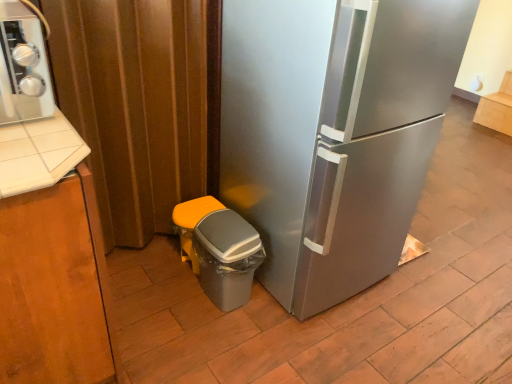
This screenshot has width=512, height=384. Describe the element at coordinates (497, 108) in the screenshot. I see `matte wood cabinet at upper right, placed as the first cabinetry when sorted from top to bottom` at that location.

This screenshot has height=384, width=512. Describe the element at coordinates (54, 288) in the screenshot. I see `brushed wood cabinet at left, positioned as the 2th cabinetry in top-to-bottom order` at that location.

Describe the element at coordinates (192, 224) in the screenshot. I see `gray plastic trash can at lower left` at that location.

Image resolution: width=512 pixels, height=384 pixels. Describe the element at coordinates (335, 131) in the screenshot. I see `stainless steel refrigerator at center` at that location.

The width and height of the screenshot is (512, 384). What do you see at coordinates (23, 66) in the screenshot?
I see `brushed metal stove at upper left` at bounding box center [23, 66].

The height and width of the screenshot is (384, 512). Identify the location of matte wood cabinet at upper right, placed as the first cabinetry when sorted from top to bottom. (497, 108).

Is gray plastic trash can at lower left looking in the opposite direction of matte brown curtain at left?

Yes, gray plastic trash can at lower left is facing away from matte brown curtain at left.

Is the surface of gray plastic trash can at lower left in direct contact with matte brown curtain at left?

No, gray plastic trash can at lower left is not in contact with matte brown curtain at left.

In the scene shown: Between gray plastic trash can at lower left and matte brown curtain at left, which one has smaller size?

gray plastic trash can at lower left.

From a real-world perspective, is brushed metal stove at upper left positioned over brushed wood cabinet at left, positioned as the 2th cabinetry in top-to-bottom order, based on gravity?

Yes, from a real-world perspective, brushed metal stove at upper left is on top of brushed wood cabinet at left, positioned as the 2th cabinetry in top-to-bottom order.

Where is `appliance lying above the brushed wood cabinet at left, placed as the first cabinetry when sorted from left to right (from the image's perspective)`? The width and height of the screenshot is (512, 384). appliance lying above the brushed wood cabinet at left, placed as the first cabinetry when sorted from left to right (from the image's perspective) is located at coordinates (23, 66).

Does brushed metal stove at upper left have a smaller size compared to brushed wood cabinet at left, the 2th cabinetry positioned from the back?

Yes.

Does brushed metal stove at upper left lie in front of brushed wood cabinet at left, the 2th cabinetry positioned from the back?

No, brushed metal stove at upper left is further to the viewer.

Considering the relative positions of gray plastic trash can at lower left and stainless steel refrigerator at center in the image provided, is gray plastic trash can at lower left behind stainless steel refrigerator at center?

Yes.

You are a GUI agent. You are given a task and a screenshot of the screen. Output one action in this format:
    pyautogui.click(x=<x>, y=<y>)
    Task: Click on the refrigerator located in front of the gray plastic trash can at lower left
    Image resolution: width=512 pixels, height=384 pixels.
    Given the screenshot: What is the action you would take?
    pyautogui.click(x=335, y=131)

Can you confirm if gray plastic trash can at lower left is wider than stainless steel refrigerator at center?

No, gray plastic trash can at lower left is not wider than stainless steel refrigerator at center.

Based on their positions, is gray plastic trash can at lower left located to the left or right of stainless steel refrigerator at center?

gray plastic trash can at lower left is positioned on stainless steel refrigerator at center's left side.

Are matte wood cabinet at upper right, placed as the 1th cabinetry when sorted from back to front, and matte brown curtain at left making contact?

No, matte wood cabinet at upper right, placed as the 1th cabinetry when sorted from back to front, is not next to matte brown curtain at left.

From the image's perspective, which one is positioned lower, matte wood cabinet at upper right, placed as the first cabinetry when sorted from top to bottom, or matte brown curtain at left?

matte brown curtain at left.

Is matte wood cabinet at upper right, the second cabinetry from the front, aimed at matte brown curtain at left?

Yes, matte wood cabinet at upper right, the second cabinetry from the front, is facing matte brown curtain at left.

Could you tell me if matte brown curtain at left is turned towards brushed wood cabinet at left, placed as the first cabinetry when sorted from left to right?

No, matte brown curtain at left is not facing towards brushed wood cabinet at left, placed as the first cabinetry when sorted from left to right.

Looking at this image, are matte brown curtain at left and brushed wood cabinet at left, placed as the first cabinetry when sorted from bottom to top, far apart?

No.

Which of these two, matte brown curtain at left or brushed wood cabinet at left, placed as the 2th cabinetry when sorted from right to left, stands shorter?

brushed wood cabinet at left, placed as the 2th cabinetry when sorted from right to left, is shorter.

From the image's perspective, is matte brown curtain at left located above brushed wood cabinet at left, placed as the 2th cabinetry when sorted from right to left?

Correct, matte brown curtain at left appears higher than brushed wood cabinet at left, placed as the 2th cabinetry when sorted from right to left, in the image.

Considering the relative positions of matte brown curtain at left and gray plastic trash can at lower left in the image provided, is matte brown curtain at left to the left of gray plastic trash can at lower left from the viewer's perspective?

Yes, matte brown curtain at left is to the left of gray plastic trash can at lower left.

Is there a large distance between matte brown curtain at left and gray plastic trash can at lower left?

No, there isn't a large distance between matte brown curtain at left and gray plastic trash can at lower left.

Considering the sizes of objects matte brown curtain at left and gray plastic trash can at lower left in the image provided, who is bigger, matte brown curtain at left or gray plastic trash can at lower left?

matte brown curtain at left is bigger.

Which object is wider, matte brown curtain at left or gray plastic trash can at lower left?

gray plastic trash can at lower left is wider.

Is brushed metal stove at upper left turned away from matte wood cabinet at upper right, placed as the first cabinetry when sorted from top to bottom?

No, brushed metal stove at upper left is not facing the opposite direction of matte wood cabinet at upper right, placed as the first cabinetry when sorted from top to bottom.

Who is taller, brushed metal stove at upper left or matte wood cabinet at upper right, placed as the 1th cabinetry when sorted from back to front?

Standing taller between the two is brushed metal stove at upper left.

Is brushed metal stove at upper left with matte wood cabinet at upper right, placed as the first cabinetry when sorted from top to bottom?

No, brushed metal stove at upper left is not touching matte wood cabinet at upper right, placed as the first cabinetry when sorted from top to bottom.

Locate an element on the screen. The width and height of the screenshot is (512, 384). curtain above the gray plastic trash can at lower left (from the image's perspective) is located at coordinates (135, 105).

Find the location of a particular element. cabinetry that appears in front of the brushed metal stove at upper left is located at coordinates (54, 288).

Based on their spatial positions, is brushed wood cabinet at left, placed as the first cabinetry when sorted from bottom to top, or matte brown curtain at left further from gray plastic potty at lower left?

Among the two, brushed wood cabinet at left, placed as the first cabinetry when sorted from bottom to top, is located further to gray plastic potty at lower left.

Which object lies further to the anchor point gray plastic potty at lower left, stainless steel refrigerator at center or brushed metal stove at upper left?

The object further to gray plastic potty at lower left is brushed metal stove at upper left.

Which object lies further to the anchor point matte wood cabinet at upper right, placed as the 2th cabinetry when sorted from bottom to top, brushed wood cabinet at left, placed as the 2th cabinetry when sorted from right to left, or gray plastic trash can at lower left?

The object further to matte wood cabinet at upper right, placed as the 2th cabinetry when sorted from bottom to top, is brushed wood cabinet at left, placed as the 2th cabinetry when sorted from right to left.

Based on their spatial positions, is gray plastic potty at lower left or matte wood cabinet at upper right, the 1th cabinetry positioned from the right, further from brushed wood cabinet at left, the 2th cabinetry positioned from the back?

matte wood cabinet at upper right, the 1th cabinetry positioned from the right, is positioned further to the anchor brushed wood cabinet at left, the 2th cabinetry positioned from the back.

Looking at the image, which one is located closer to gray plastic potty at lower left, gray plastic trash can at lower left or brushed wood cabinet at left, positioned as the 2th cabinetry in top-to-bottom order?

gray plastic trash can at lower left is closer to gray plastic potty at lower left.

From the image, which object appears to be farther from gray plastic potty at lower left, gray plastic trash can at lower left or brushed metal stove at upper left?

brushed metal stove at upper left lies further to gray plastic potty at lower left than the other object.

Which object lies further to the anchor point matte brown curtain at left, stainless steel refrigerator at center or matte wood cabinet at upper right, the second cabinetry from the front?

Among the two, matte wood cabinet at upper right, the second cabinetry from the front, is located further to matte brown curtain at left.

Looking at the image, which one is located closer to brushed wood cabinet at left, placed as the first cabinetry when sorted from left to right, stainless steel refrigerator at center or brushed metal stove at upper left?

Based on the image, brushed metal stove at upper left appears to be nearer to brushed wood cabinet at left, placed as the first cabinetry when sorted from left to right.

Find the location of a particular element. refrigerator between matte brown curtain at left and matte wood cabinet at upper right, the second cabinetry from the front, from left to right is located at coordinates (335, 131).

You are a GUI agent. You are given a task and a screenshot of the screen. Output one action in this format:
    pyautogui.click(x=<x>, y=<y>)
    Task: Click on the potty between brushed wood cabinet at left, positioned as the first cabinetry in front-to-back order, and gray plastic trash can at lower left, along the z-axis
    This screenshot has height=384, width=512.
    Given the screenshot: What is the action you would take?
    pyautogui.click(x=227, y=257)

The height and width of the screenshot is (384, 512). What are the coordinates of `potty between brushed metal stove at upper left and gray plastic trash can at lower left along the z-axis` in the screenshot? It's located at (227, 257).

The height and width of the screenshot is (384, 512). Find the location of `appliance between brushed wood cabinet at left, the 2th cabinetry positioned from the back, and gray plastic trash can at lower left from front to back`. appliance between brushed wood cabinet at left, the 2th cabinetry positioned from the back, and gray plastic trash can at lower left from front to back is located at coordinates (23, 66).